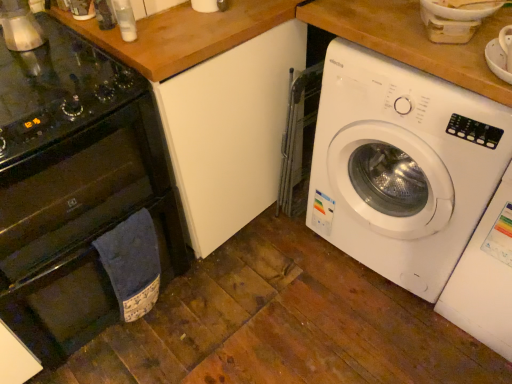
Question: From a real-world perspective, is white plastic washing machine at right, the 1th washing machine viewed from the left, physically located above or below black glass gas stove at left?

Choices:
 (A) below
 (B) above

Answer: (A)

Question: Based on their sizes in the image, would you say white plastic washing machine at right, the 1th washing machine viewed from the left, is bigger or smaller than black glass gas stove at left?

Choices:
 (A) small
 (B) big

Answer: (B)

Question: Which object is the farthest from the black glass oven at left?

Choices:
 (A) white plastic washing machine at right, the first washing machine viewed from the right
 (B) metallic silver kettle at upper left
 (C) black glass gas stove at left
 (D) white plastic washing machine at right, the 2th washing machine from the right

Answer: (A)

Question: Estimate the real-world distances between objects in this image. Which object is closer to the black glass gas stove at left?

Choices:
 (A) metallic silver kettle at upper left
 (B) white plastic washing machine at right, the 2th washing machine from the right
 (C) white plastic washing machine at right, the 2th washing machine viewed from the left
 (D) black glass oven at left

Answer: (A)